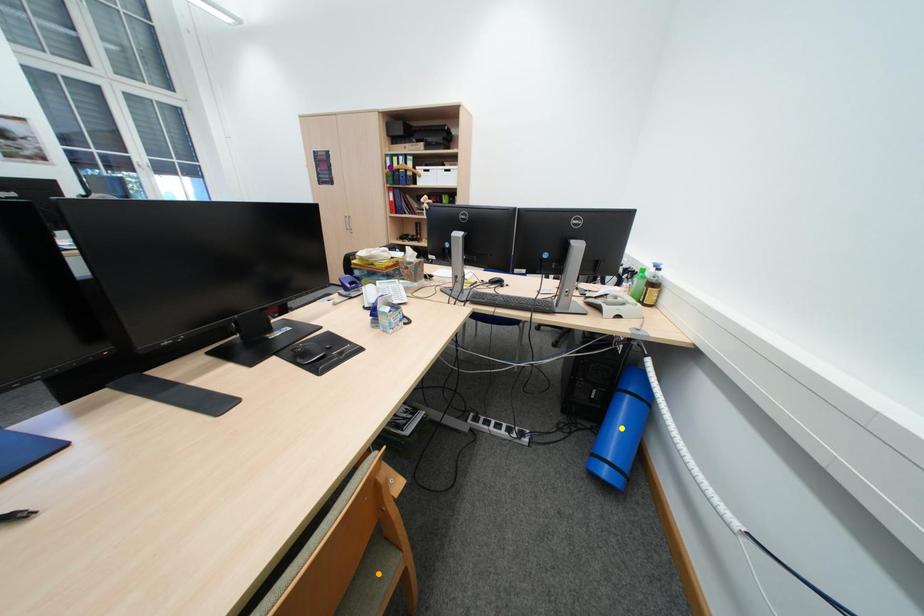
Order these from farthest to nearest:
orange point, purple point, yellow point

1. purple point
2. yellow point
3. orange point